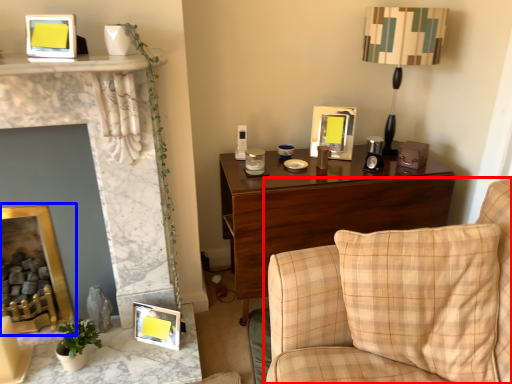
Question: Which point is closer to the camera, studio couch (highlighted by a red box) or picture frame (highlighted by a blue box)?

Choices:
 (A) studio couch
 (B) picture frame

Answer: (A)